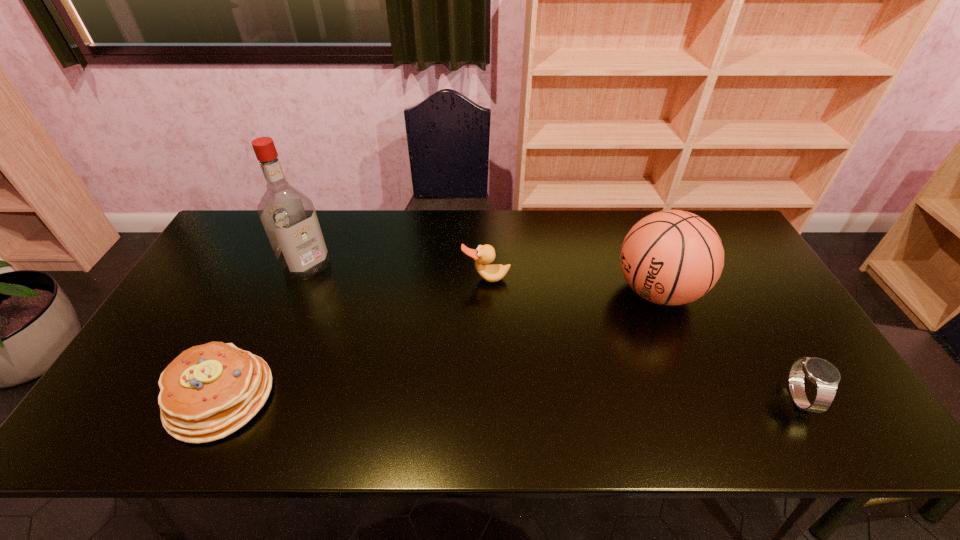
Where is `free spot on the desktop that is between the pancake and the rightmost object and is positioned on the beak of the third object from left to right`? The width and height of the screenshot is (960, 540). free spot on the desktop that is between the pancake and the rightmost object and is positioned on the beak of the third object from left to right is located at coordinates (492, 397).

I want to click on vacant spot on the desktop that is between the pancake and the rightmost object and is positioned on the surface of the basketball near the brand logo, so click(448, 397).

I want to click on free space on the desktop that is between the pancake and the rightmost object and is positioned on the front-facing side of the tallest object, so click(x=460, y=397).